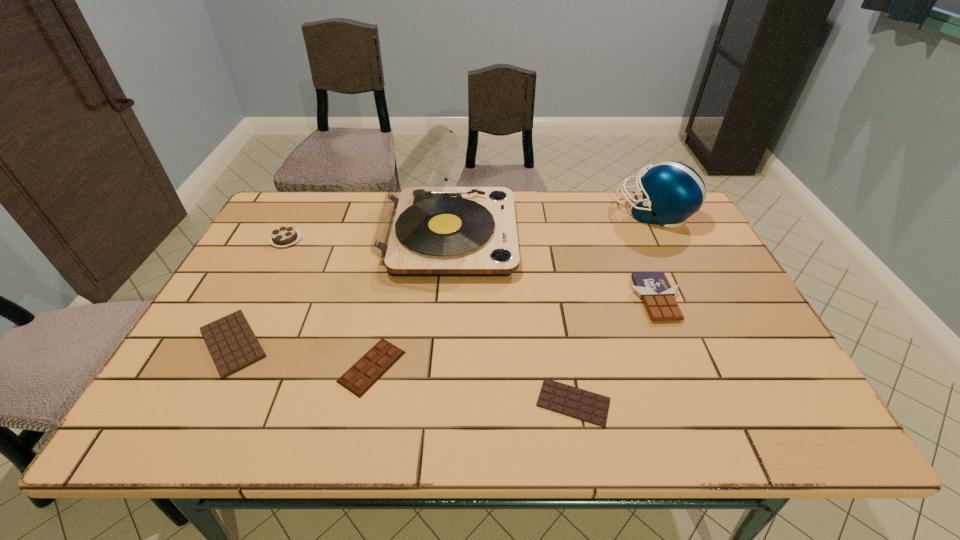
At what (x,y) coordinates should I click in order to perform the action: click on vacant space at the right edge of the desktop. Please return your answer as a coordinate pair (x, y). This screenshot has width=960, height=540. Looking at the image, I should click on (685, 251).

Where is `free space at the far left corner`? free space at the far left corner is located at coordinates (279, 204).

Where is `free region at the near left corner of the desktop`? Image resolution: width=960 pixels, height=540 pixels. free region at the near left corner of the desktop is located at coordinates (167, 427).

What are the coordinates of `vacant space that's between the shortest object and the record player` in the screenshot? It's located at (512, 319).

I want to click on vacant region between the football helmet and the leftmost chocolate bar, so click(x=443, y=278).

I want to click on empty location between the record player and the third chocolate bar from right to left, so click(411, 301).

At what (x,y) coordinates should I click in order to perform the action: click on vacant region between the tallest chocolate bar and the tallest object. Please return your answer as a coordinate pair (x, y). Looking at the image, I should click on (552, 267).

This screenshot has height=540, width=960. Identify the location of vacant region between the third chocolate bar from right to left and the tallest chocolate bar. click(x=514, y=333).

Identify the location of free space between the third object from right to left and the record player. (512, 319).

This screenshot has height=540, width=960. What are the coordinates of `free space between the football helmet and the tallest chocolate bar` in the screenshot? It's located at [x=654, y=256].